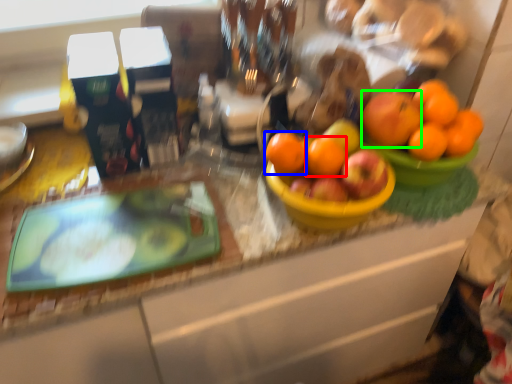
Question: Which object is positioned closest to orange (highlighted by a red box)? Select from orange (highlighted by a blue box) and orange (highlighted by a green box).

Choices:
 (A) orange
 (B) orange

Answer: (A)